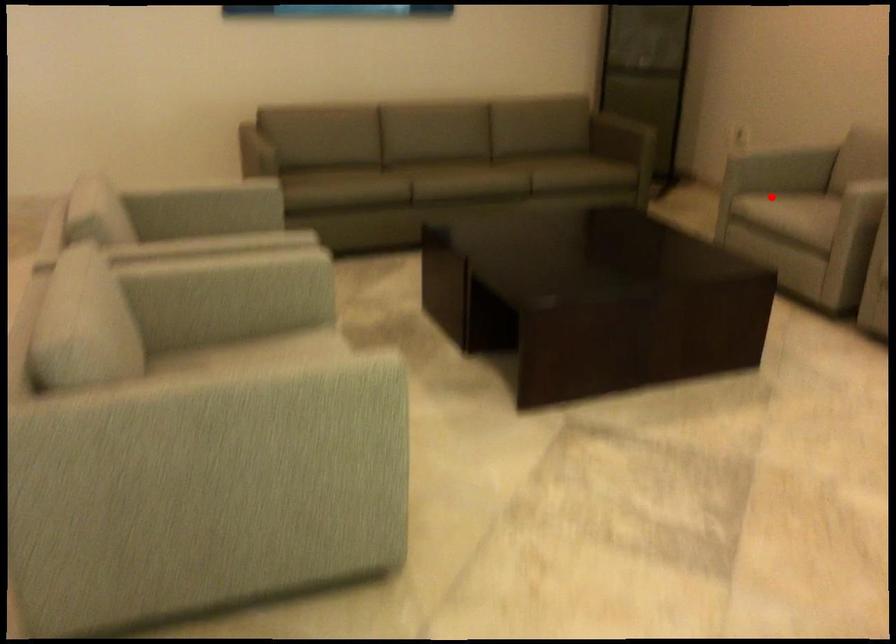
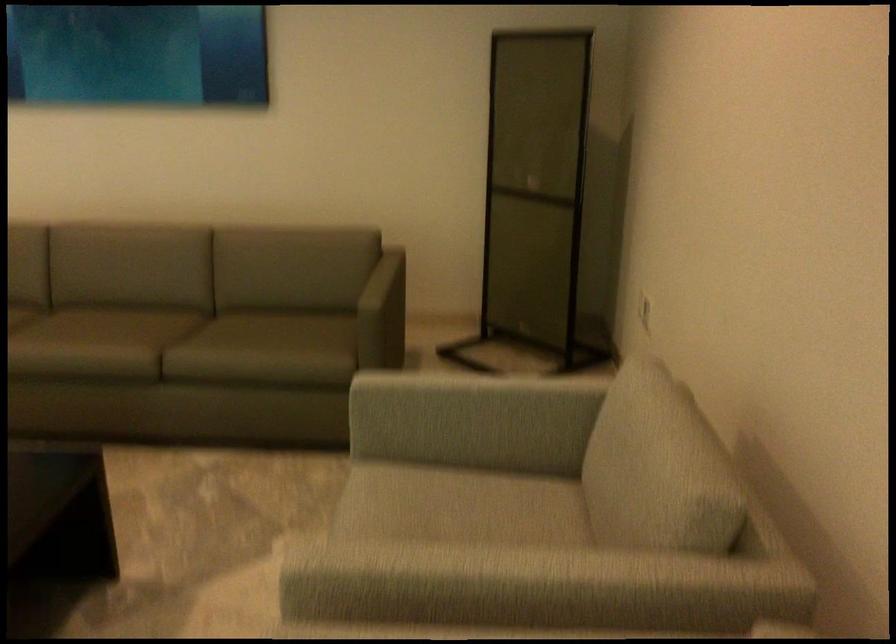
The point at the highlighted location is marked in the first image. Where is the corresponding point in the second image?

(455, 491)